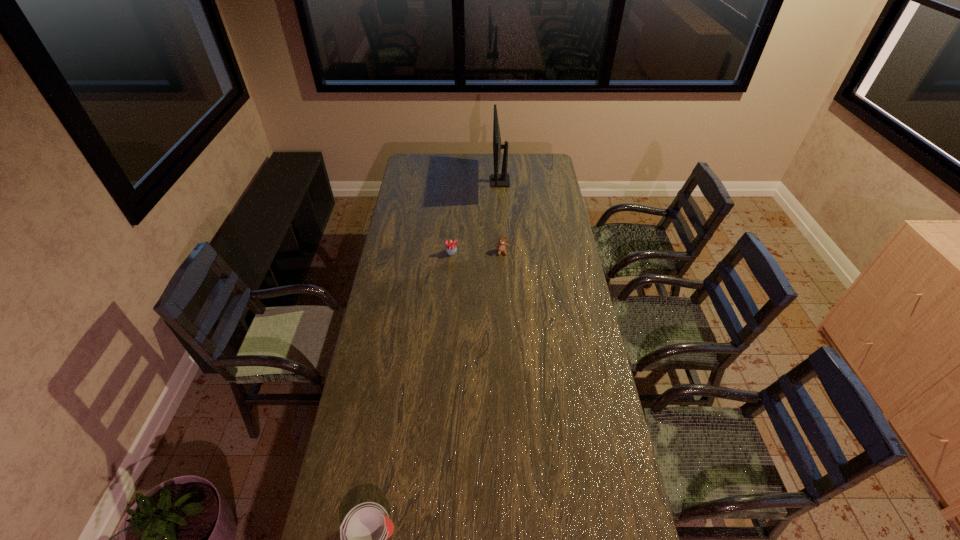
Identify which object is the third closest to the tallest object. Please provide its 2D coordinates. Your answer should be formatted as a tuple, i.e. [(x, y)], where the tuple contains the x and y coordinates of a point satisfying the conditions above.

[(363, 533)]

Select which object is the second closest to the cupcake. Please provide its 2D coordinates. Your answer should be formatted as a tuple, i.e. [(x, y)], where the tuple contains the x and y coordinates of a point satisfying the conditions above.

[(497, 180)]